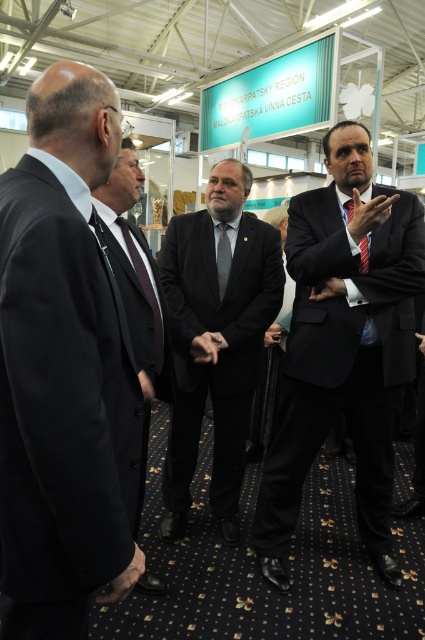
Question: Which point is farther to the camera?

Choices:
 (A) black matte suit at center
 (B) black suit at left
 (C) black silk tie at center
 (D) black suit at center

Answer: (A)

Question: Which point is farther to the camera?

Choices:
 (A) (227, 227)
 (B) (113, 186)

Answer: (A)

Question: Does black matte suit at center appear on the left side of black silk tie at center?

Choices:
 (A) no
 (B) yes

Answer: (A)

Question: Does black suit at left appear on the left side of black suit at center?

Choices:
 (A) yes
 (B) no

Answer: (A)

Question: Among these objects, which one is nearest to the camera?

Choices:
 (A) black matte suit at center
 (B) black suit at center
 (C) black suit at left
 (D) black velvet suit at center

Answer: (C)

Question: Is black suit at left above black silk tie at center?

Choices:
 (A) yes
 (B) no

Answer: (B)